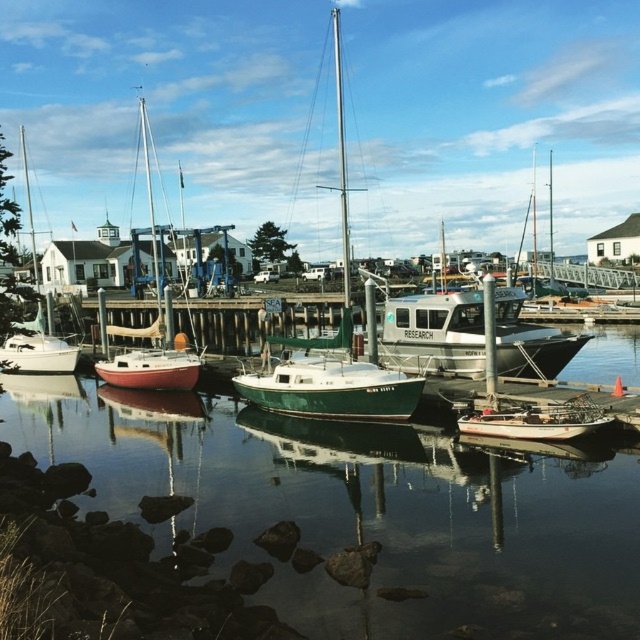
You are standing on the wooden pier and want to find the green matte water at center. According to the coordinates given, where should you look relative to the pier?

The green matte water at center is located at coordinates point (x=358, y=509), so you should look towards the center area of the scene where the water is positioned.

From the picture: You are standing at the point labeled point (28, 337) in the marina scene. What object are you currently standing on?

You are standing on the white matte sailboat at left.

Looking at this image, you are a dock worker who needs to move the wooden boat at lower right. The white matte sailboat at left is currently occupying the space you need to access. Which boat is wider so you can determine which requires more space to maneuver?

The white matte sailboat at left is wider than the wooden boat at lower right, so it requires more space to maneuver.